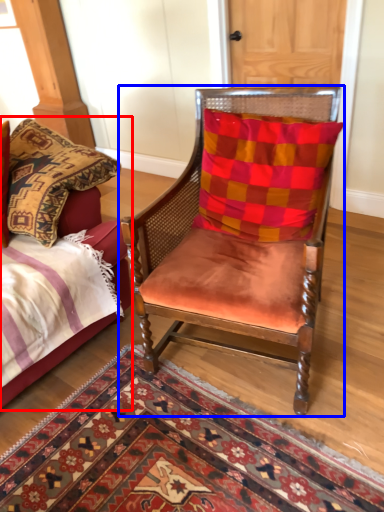
Question: Which object appears farthest to the camera in this image, bed (highlighted by a red box) or chair (highlighted by a blue box)?

Choices:
 (A) bed
 (B) chair

Answer: (A)